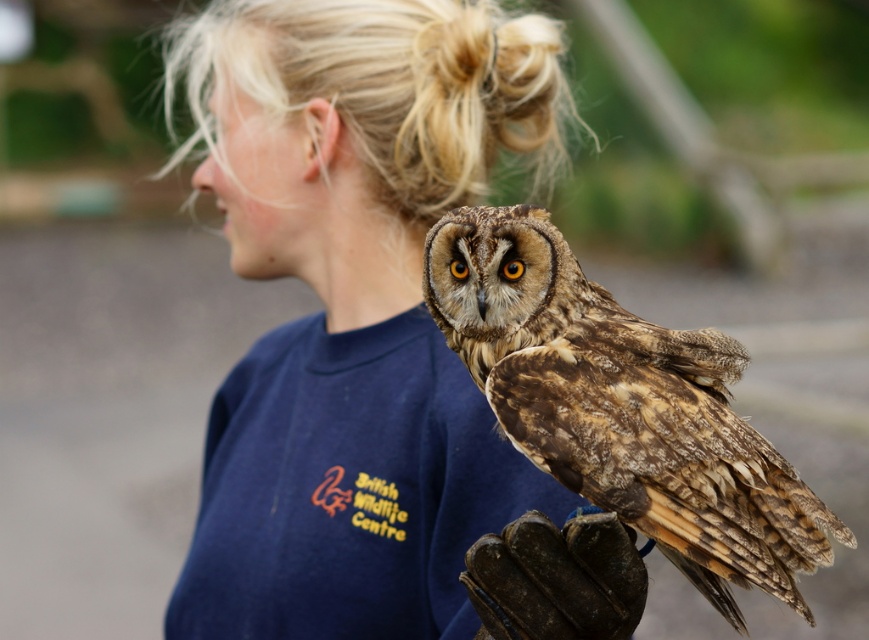
Which is below, blue cotton shirt at center or brown speckled owl at center?

brown speckled owl at center is below.

Based on the photo, does blue cotton shirt at center come in front of brown speckled owl at center?

No, blue cotton shirt at center is behind brown speckled owl at center.

Is point (399, 54) positioned behind point (596, 444)?

Yes, it is.

This screenshot has height=640, width=869. Identify the location of blue cotton shirt at center. (372, 333).

Between blue cotton shirt at center and leather glove at lower right, which one is positioned lower?

→ Positioned lower is leather glove at lower right.

Can you confirm if blue cotton shirt at center is taller than leather glove at lower right?

Yes.

Describe the element at coordinates (372, 333) in the screenshot. The width and height of the screenshot is (869, 640). I see `blue cotton shirt at center` at that location.

Locate an element on the screen. This screenshot has width=869, height=640. blue cotton shirt at center is located at coordinates (372, 333).

Can you confirm if brown speckled owl at center is positioned below leather glove at lower right?

Incorrect, brown speckled owl at center is not positioned below leather glove at lower right.

Does brown speckled owl at center have a smaller size compared to leather glove at lower right?

No, brown speckled owl at center is not smaller than leather glove at lower right.

Measure the distance between brown speckled owl at center and camera.

brown speckled owl at center is 5.48 feet away from camera.

The width and height of the screenshot is (869, 640). What are the coordinates of `brown speckled owl at center` in the screenshot? It's located at coord(622,406).